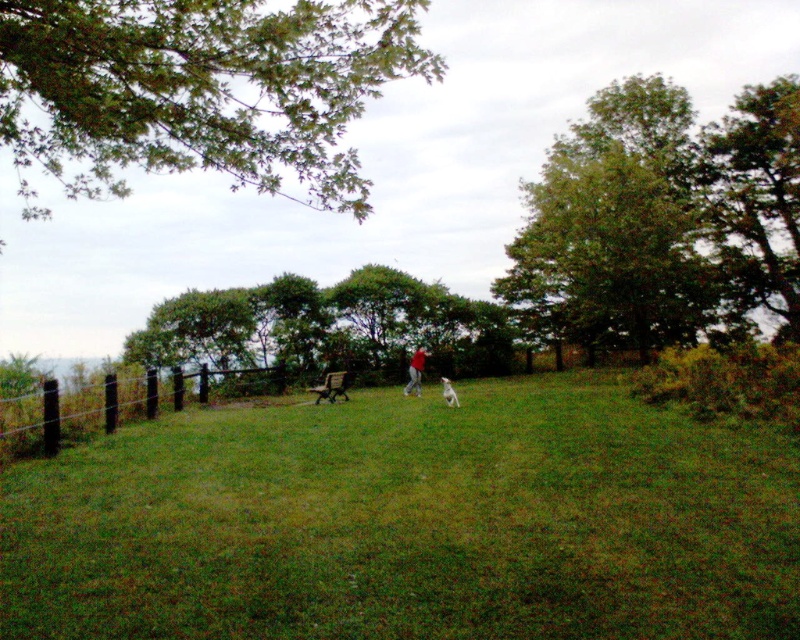
Question: Is green leafy tree at upper right above brown wooden fence at left?

Choices:
 (A) yes
 (B) no

Answer: (A)

Question: Which point appears farthest from the camera in this image?

Choices:
 (A) click(397, 593)
 (B) click(745, 257)
 (C) click(454, 394)
 (D) click(240, 294)

Answer: (B)

Question: Estimate the real-world distances between objects in this image. Which object is closer to the green grassy field at center?

Choices:
 (A) brown wooden fence at left
 (B) red matte shirt at center
 (C) green leafy tree at upper left

Answer: (A)

Question: Is the position of green grassy field at center less distant than that of brown wooden fence at left?

Choices:
 (A) no
 (B) yes

Answer: (B)

Question: Which object is closer to the camera taking this photo?

Choices:
 (A) red matte shirt at center
 (B) green grassy field at center

Answer: (B)

Question: Is red matte shirt at center further to the viewer compared to white fluffy dog at center?

Choices:
 (A) yes
 (B) no

Answer: (A)